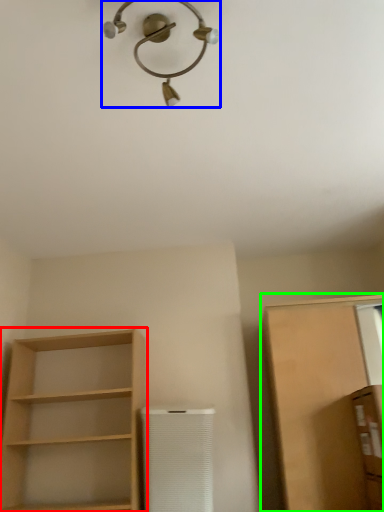
Question: Which object is positioned closest to shelf (highlighted by a red box)? Select from light fixture (highlighted by a blue box) and cabinetry (highlighted by a green box).

Choices:
 (A) light fixture
 (B) cabinetry

Answer: (B)